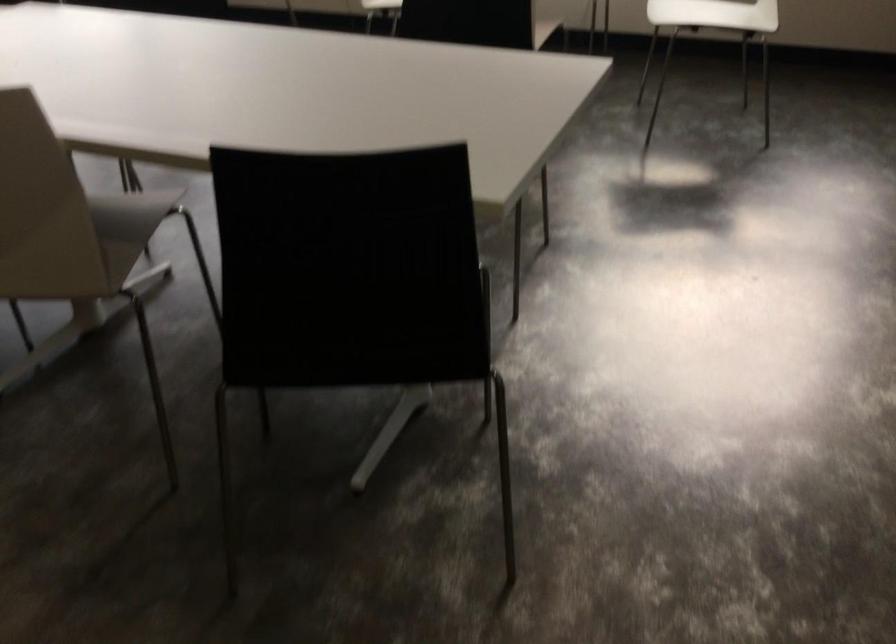
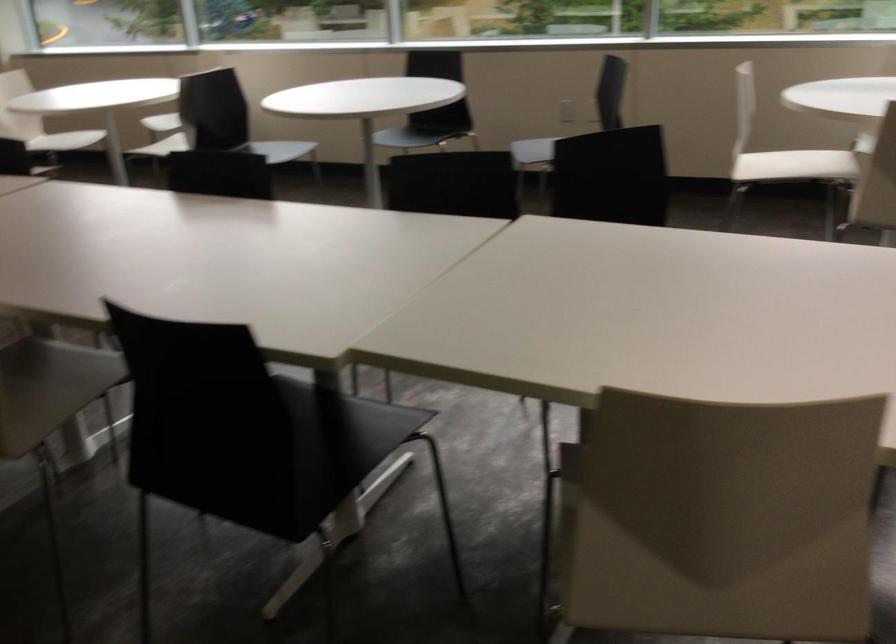
Question: In a continuous first-person perspective shot, in which direction is the camera moving?

Choices:
 (A) Left
 (B) Right
 (C) Forward
 (D) Backward

Answer: (A)